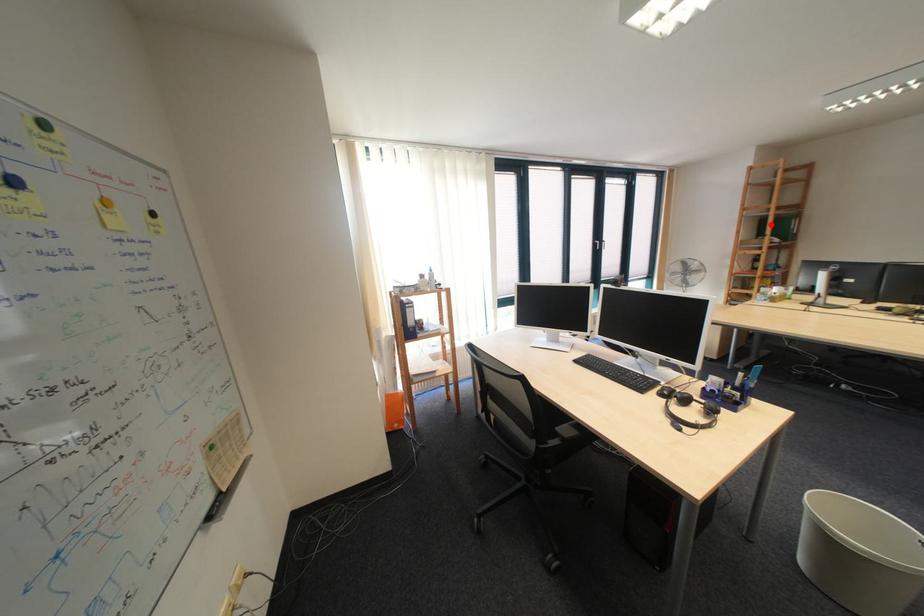
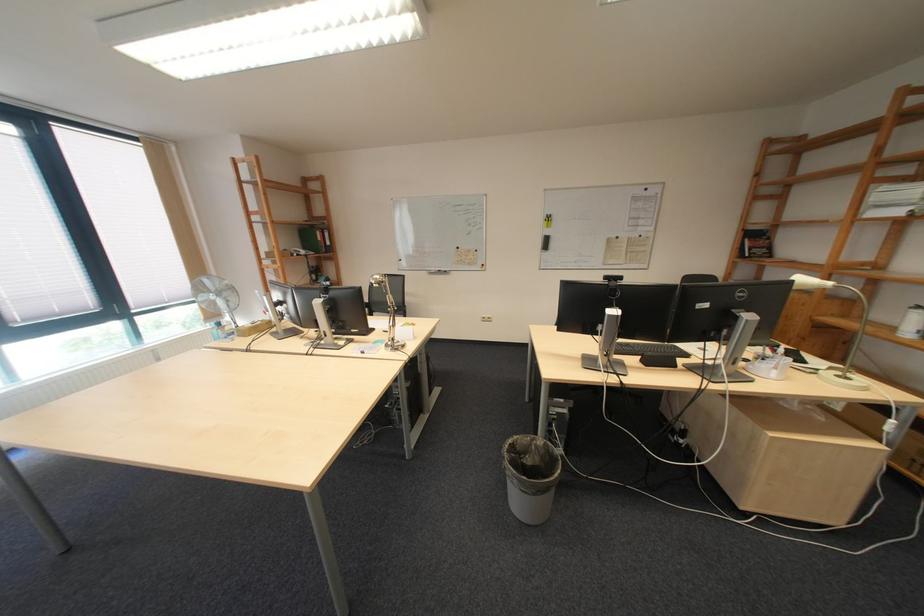
Question: I am providing you with two images of the same scene from different viewpoints. Given a red point in image1, look at the same physical point in image2. Is it:

Choices:
 (A) Closer to the viewpoint
 (B) Farther from the viewpoint

Answer: (A)